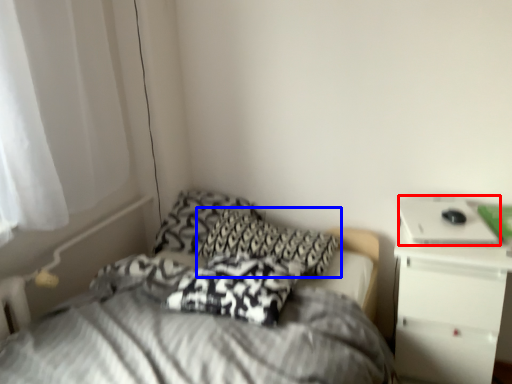
Question: Which of the following is the closest to the observer, laptop (highlighted by a red box) or pillow (highlighted by a blue box)?

Choices:
 (A) laptop
 (B) pillow

Answer: (A)